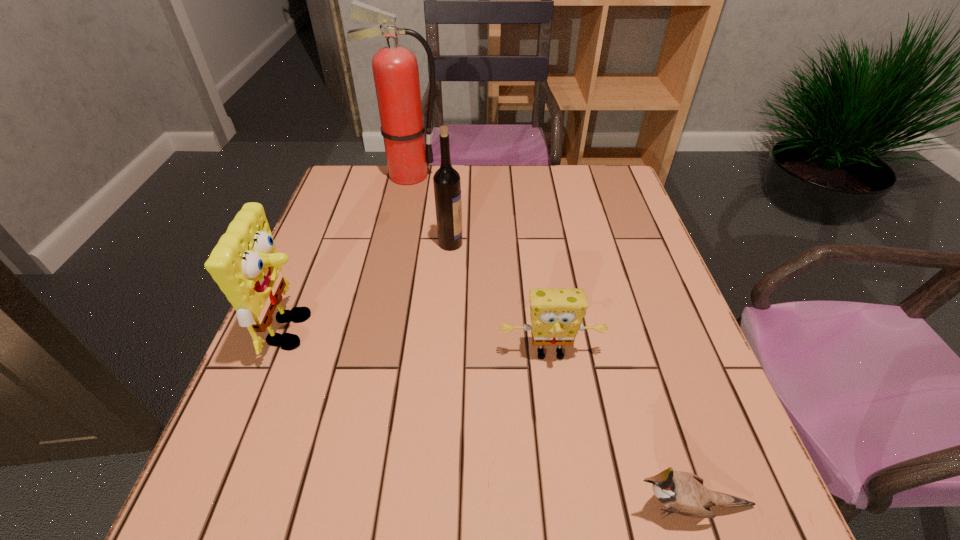
Identify the location of object positioned at the right edge. (683, 493).

This screenshot has height=540, width=960. I want to click on object at the far left corner, so click(395, 69).

Locate an element on the screen. Image resolution: width=960 pixels, height=540 pixels. object at the near right corner is located at coordinates (683, 493).

Where is `vacant region at the far edge`? vacant region at the far edge is located at coordinates (423, 183).

The height and width of the screenshot is (540, 960). In the image, there is a desktop. Find the location of `vacant space at the left edge`. vacant space at the left edge is located at coordinates (332, 281).

This screenshot has height=540, width=960. Identify the location of vacant space at the right edge of the desktop. (634, 401).

Image resolution: width=960 pixels, height=540 pixels. Identify the location of vacant area at the near right corner. (768, 515).

Where is `unoccupied area between the shortest object and the third object from right to left`? The height and width of the screenshot is (540, 960). unoccupied area between the shortest object and the third object from right to left is located at coordinates (570, 375).

Locate an element on the screen. The height and width of the screenshot is (540, 960). free spot between the fire extinguisher and the fourth nearest object is located at coordinates (429, 209).

Locate an element on the screen. This screenshot has width=960, height=540. empty location between the tallest object and the second farthest object is located at coordinates (429, 209).